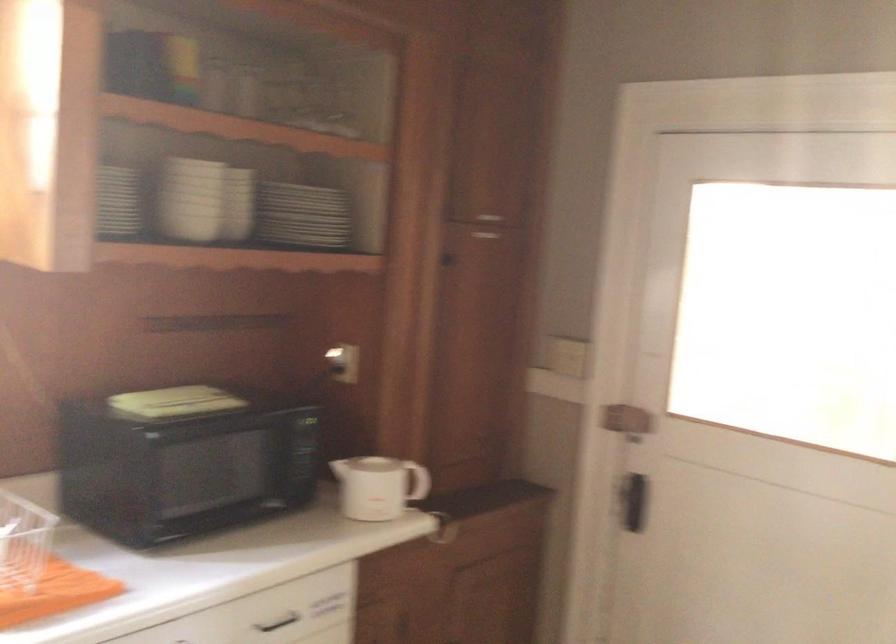
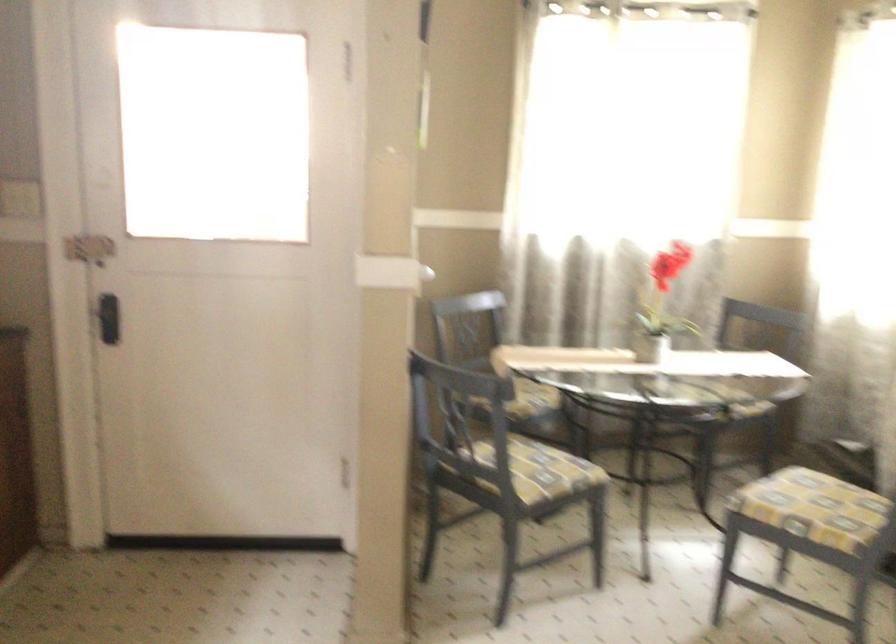
Where in the second image is the point corresponding to [609,489] from the first image?

(108, 317)